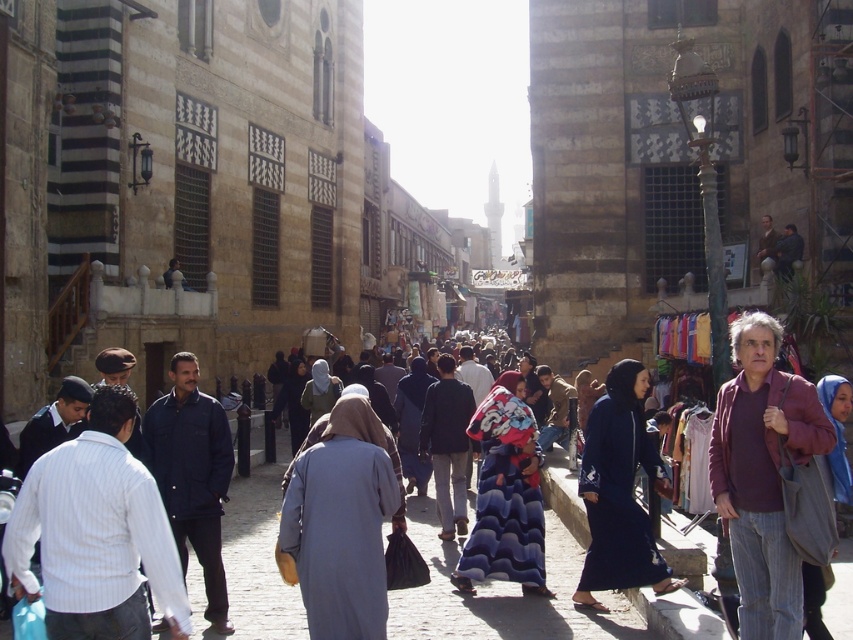
Does light gray fabric dress at center come in front of blue textured dress at center?

Yes, light gray fabric dress at center is closer to the viewer.

Is light gray fabric dress at center positioned at the back of blue textured dress at center?

No, it is not.

Identify the location of light gray fabric dress at center. (341, 520).

I want to click on light gray fabric dress at center, so click(341, 520).

Describe the element at coordinates (341, 520) in the screenshot. Image resolution: width=853 pixels, height=640 pixels. I see `light gray fabric dress at center` at that location.

Can you confirm if light gray fabric dress at center is positioned to the left of dark blue fabric abaya at center?

Correct, you'll find light gray fabric dress at center to the left of dark blue fabric abaya at center.

Is point (395, 522) positioned before point (585, 500)?

That is True.

The image size is (853, 640). In order to click on light gray fabric dress at center in this screenshot , I will do `click(341, 520)`.

Does blue textured dress at center appear under blue fabric hijab at center?

Yes.

Is point (512, 547) farther from camera compared to point (820, 388)?

Yes, point (512, 547) is farther from viewer.

You are a GUI agent. You are given a task and a screenshot of the screen. Output one action in this format:
    pyautogui.click(x=<x>, y=<y>)
    Task: Click on the blue textured dress at center
    
    Given the screenshot: What is the action you would take?
    pyautogui.click(x=505, y=493)